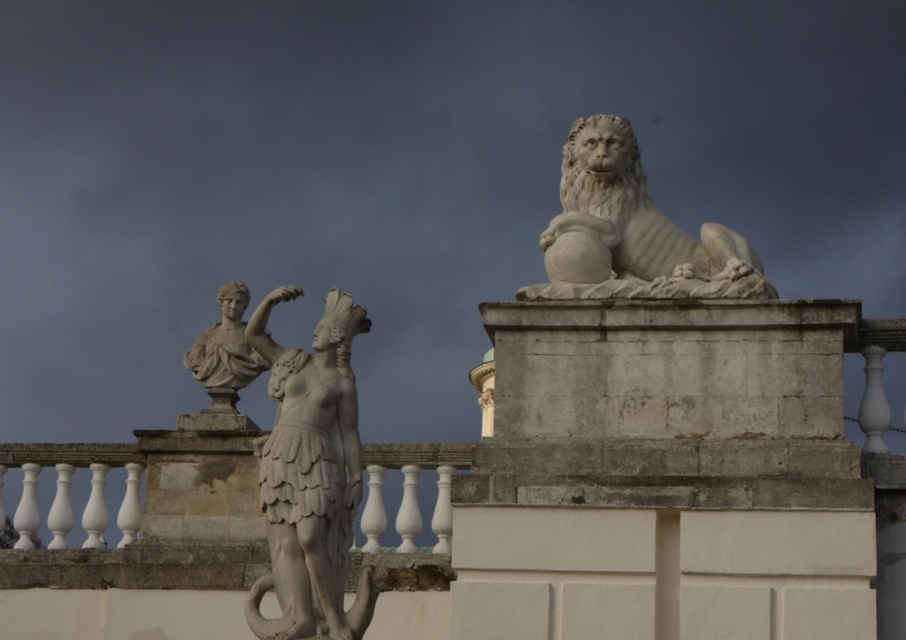
Can you confirm if white stone statue at center is bigger than white stone lion at upper right?

Yes, white stone statue at center is bigger than white stone lion at upper right.

Which is more to the right, white stone statue at center or white stone lion at upper right?

white stone lion at upper right

Is point (353, 412) behind point (641, 177)?

That is False.

Where is `white stone statue at center`? white stone statue at center is located at coordinates pyautogui.click(x=310, y=477).